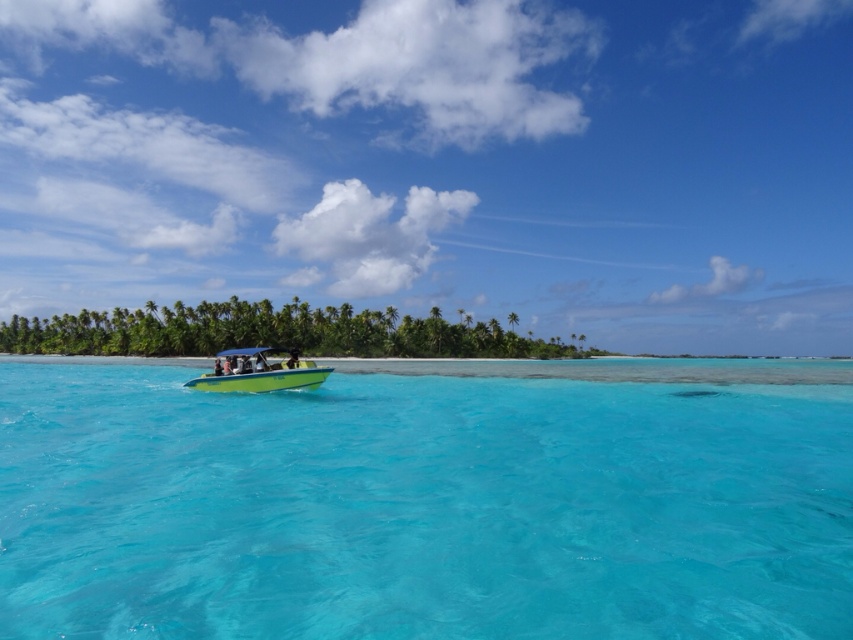
You are a drone operator trying to capture a photo of the bright green motorboat with blue canopy on the left side and the transparent blue water at center. According to the coordinates provided, where is the point at (421,508) located?

The point at (421,508) corresponds to the transparent blue water at center.

From the picture: You are a photographer trying to capture the green plastic boat at center in the image. Since the transparent blue water at center is smaller than the boat, will the boat appear larger in the photo compared to the water?

The transparent blue water at center is smaller than the green plastic boat at center, so the boat will appear larger in the photo compared to the water.

You are a passenger on the green plastic boat at center and want to see the transparent blue water at center. In which direction should you look from your position on the boat?

You should look downward from the green plastic boat at center to see the transparent blue water at center since it is located below the boat.